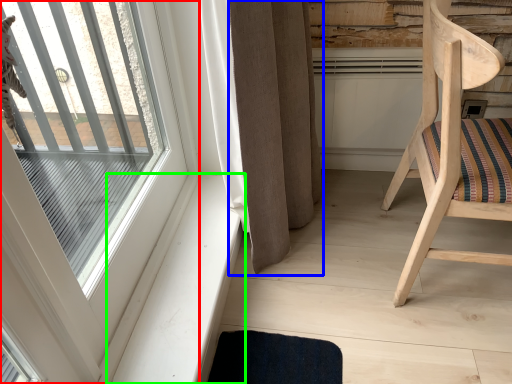
Question: Which is farther away from window (highlighted by a red box)? curtain (highlighted by a blue box) or window sill (highlighted by a green box)?

Choices:
 (A) curtain
 (B) window sill

Answer: (A)